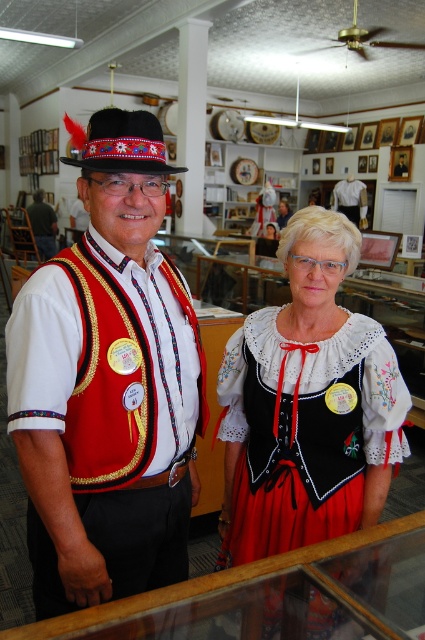
You are an anthropologist studying traditional attire and need to locate the embroidered cotton blouse at center in the image. According to the coordinates provided, where exactly is it positioned?

The embroidered cotton blouse at center is located at the 2D coordinates point (308, 404).

You are a photographer at the event and want to capture both the matte red vest at left and the matte red vest at center in a single frame. Which vest should you focus on first to ensure both are in the shot?

The matte red vest at left is positioned under the matte red vest at center, so focusing on the matte red vest at center first will allow both to be captured in the frame.

You are a costume designer measuring the spacing between two key pieces in a historical reenactment scene. The scene requires the matte red vest at left to be at least 30 centimeters away from the embroidered cotton blouse at center for proper airflow. Based on the provided image, does the current spacing meet this requirement?

The distance between the matte red vest at left and the embroidered cotton blouse at center is 31.17 centimeters, which exceeds the required 30 centimeters. Therefore, the spacing meets the airflow requirement.